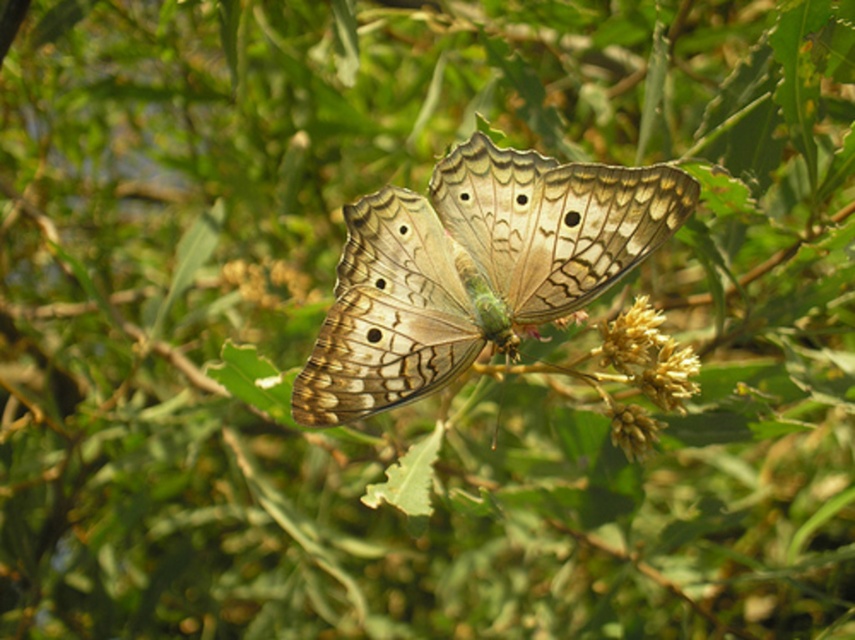
Question: Can you confirm if brown textured butterfly at center is positioned below yellowish-green textured flower at center-right?

Choices:
 (A) yes
 (B) no

Answer: (B)

Question: Which object appears closest to the camera in this image?

Choices:
 (A) brown textured butterfly at center
 (B) yellowish-green textured flower at center-right

Answer: (A)

Question: Is brown textured butterfly at center wider than yellowish-green textured flower at center-right?

Choices:
 (A) no
 (B) yes

Answer: (B)

Question: Which point appears farthest from the camera in this image?

Choices:
 (A) (635, 358)
 (B) (396, 371)

Answer: (A)

Question: Where is brown textured butterfly at center located in relation to yellowish-green textured flower at center-right in the image?

Choices:
 (A) above
 (B) below

Answer: (A)